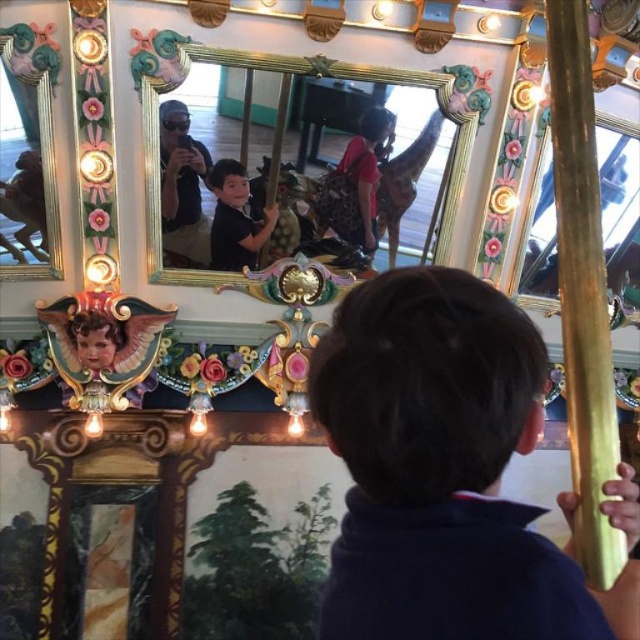
You are standing at the center of the carousel and want to locate the child with dark brown hair at center. What are the coordinates of the child?

The coordinates of the child with dark brown hair at center are at point (438, 467).